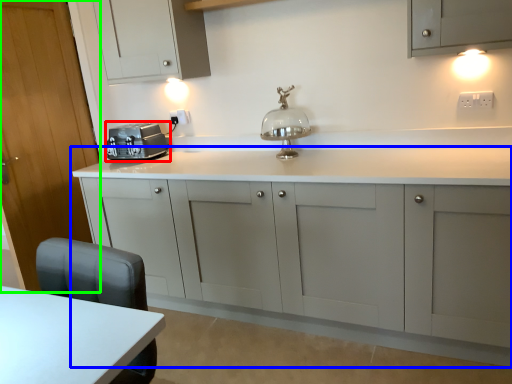
Question: Based on their relative distances, which object is farther from home appliance (highlighted by a red box)? Choose from cabinetry (highlighted by a blue box) and door (highlighted by a green box).

Choices:
 (A) cabinetry
 (B) door

Answer: (A)